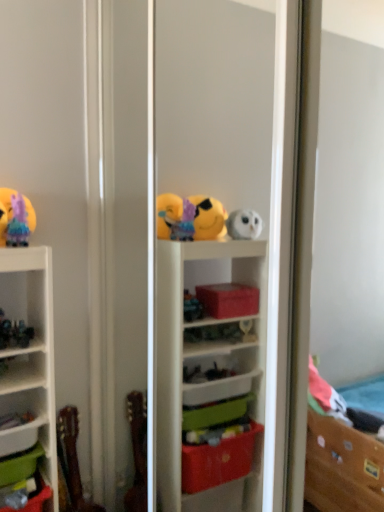
Question: Should I look upward or downward to see transparent plastic shelf at center?

Choices:
 (A) down
 (B) up

Answer: (A)

Question: Is green plastic storage box at lower left, which ranks as the 1th storage box in bottom-to-top order, a part of metallic green figurine at left, which is the 2th toy from bottom to top?

Choices:
 (A) yes
 (B) no

Answer: (B)

Question: Does metallic green figurine at left, arranged as the 2th toy when viewed from the top, appear on the left side of green plastic storage box at lower left, the second storage box when ordered from top to bottom?

Choices:
 (A) no
 (B) yes

Answer: (A)

Question: Does metallic green figurine at left, arranged as the 2th toy when viewed from the top, have a lesser height compared to green plastic storage box at lower left, the second storage box when ordered from top to bottom?

Choices:
 (A) yes
 (B) no

Answer: (A)

Question: Is the surface of metallic green figurine at left, which is the 2th toy from bottom to top, in direct contact with green plastic storage box at lower left, the second storage box when ordered from top to bottom?

Choices:
 (A) no
 (B) yes

Answer: (A)

Question: From a real-world perspective, is metallic green figurine at left, arranged as the 2th toy when viewed from the top, physically above green plastic storage box at lower left, which ranks as the 1th storage box in bottom-to-top order?

Choices:
 (A) no
 (B) yes

Answer: (B)

Question: Does metallic green figurine at left, which is the 2th toy from bottom to top, have a larger size compared to green plastic storage box at lower left, the second storage box when ordered from top to bottom?

Choices:
 (A) no
 (B) yes

Answer: (A)

Question: From a real-world perspective, is transparent plastic shelf at center below metallic green figurine at left, which is the 2th toy from bottom to top?

Choices:
 (A) yes
 (B) no

Answer: (B)

Question: Does transparent plastic shelf at center have a larger size compared to metallic green figurine at left, which is the 2th toy from bottom to top?

Choices:
 (A) no
 (B) yes

Answer: (B)

Question: Does transparent plastic shelf at center turn towards metallic green figurine at left, arranged as the 2th toy when viewed from the top?

Choices:
 (A) yes
 (B) no

Answer: (A)

Question: Can you confirm if transparent plastic shelf at center is smaller than metallic green figurine at left, arranged as the 2th toy when viewed from the top?

Choices:
 (A) yes
 (B) no

Answer: (B)

Question: From the image's perspective, would you say transparent plastic shelf at center is shown under metallic green figurine at left, arranged as the 2th toy when viewed from the top?

Choices:
 (A) yes
 (B) no

Answer: (B)

Question: Does transparent plastic shelf at center come in front of metallic green figurine at left, arranged as the 2th toy when viewed from the top?

Choices:
 (A) yes
 (B) no

Answer: (A)

Question: From the image's perspective, is pastel rainbow tulle at upper left, which is the 3th toy from bottom to top, over green plastic storage box at lower left, the second storage box when ordered from top to bottom?

Choices:
 (A) yes
 (B) no

Answer: (A)